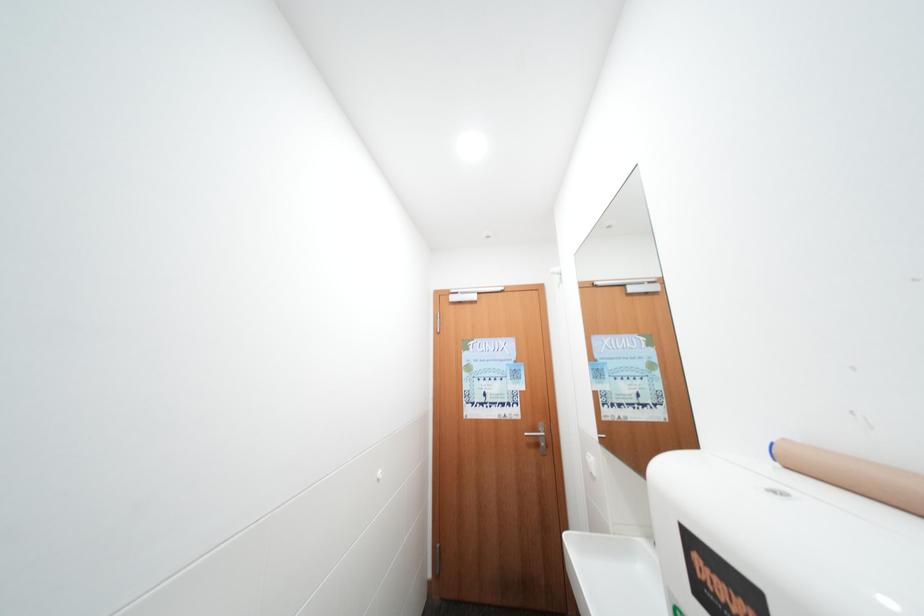
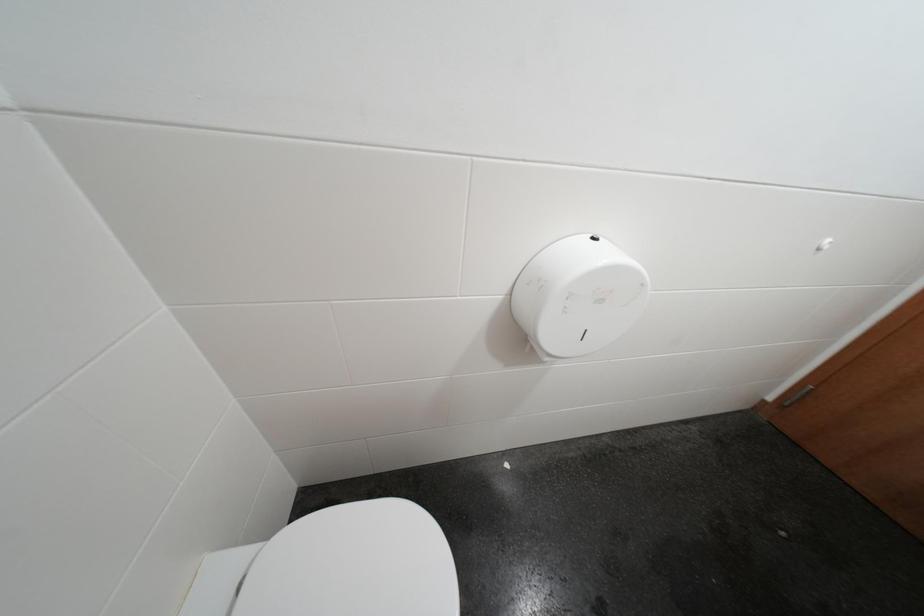
How did the camera likely rotate?

The rotation direction of the camera is left-down.